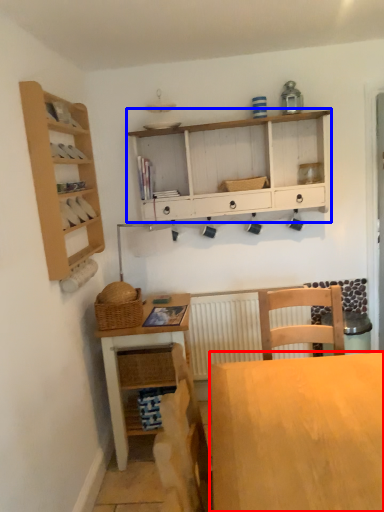
Question: Which point is closer to the camera, desk (highlighted by a red box) or cabinetry (highlighted by a blue box)?

Choices:
 (A) desk
 (B) cabinetry

Answer: (A)